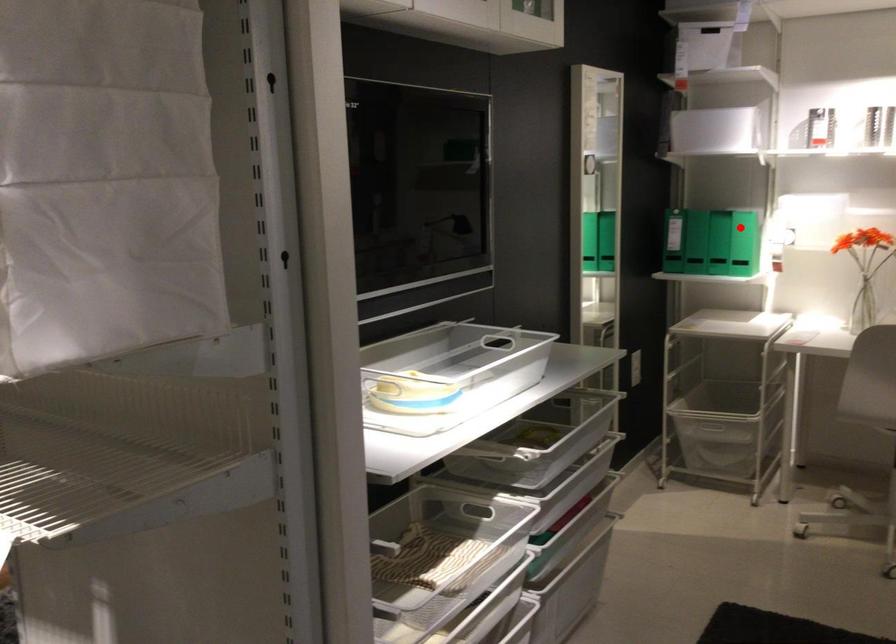
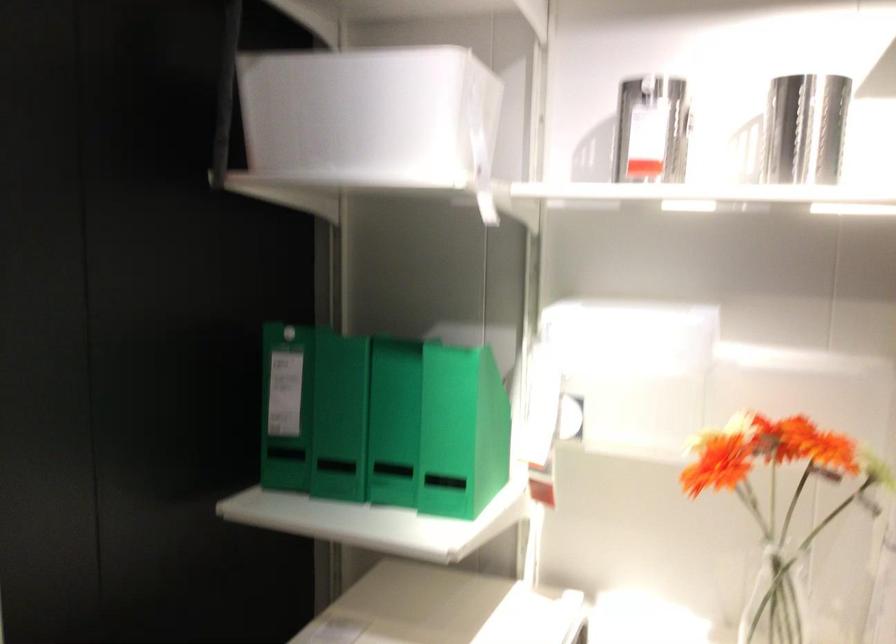
Question: I am providing you with two images of the same scene from different viewpoints. Given a red point in image1, look at the same physical point in image2. Is it:

Choices:
 (A) Closer to the viewpoint
 (B) Farther from the viewpoint

Answer: (A)